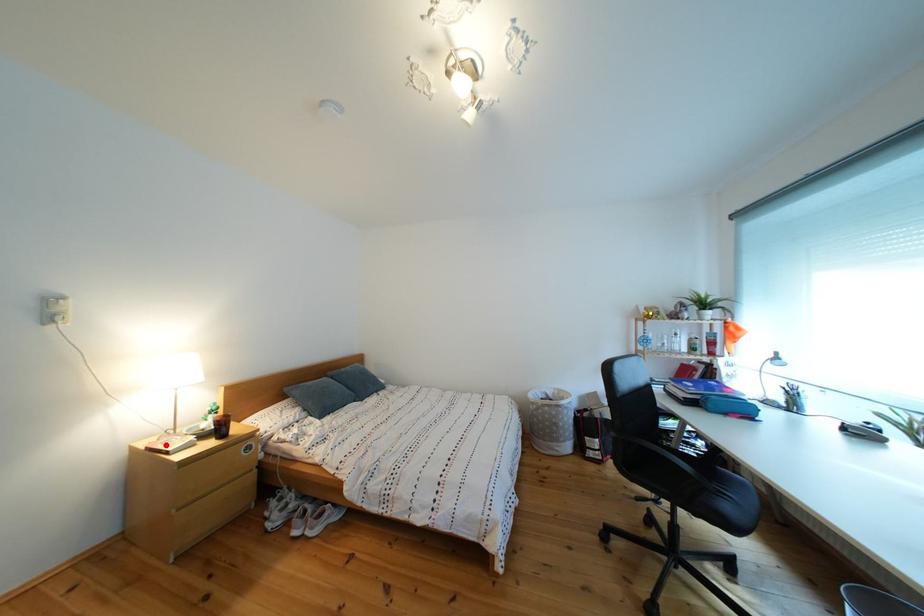
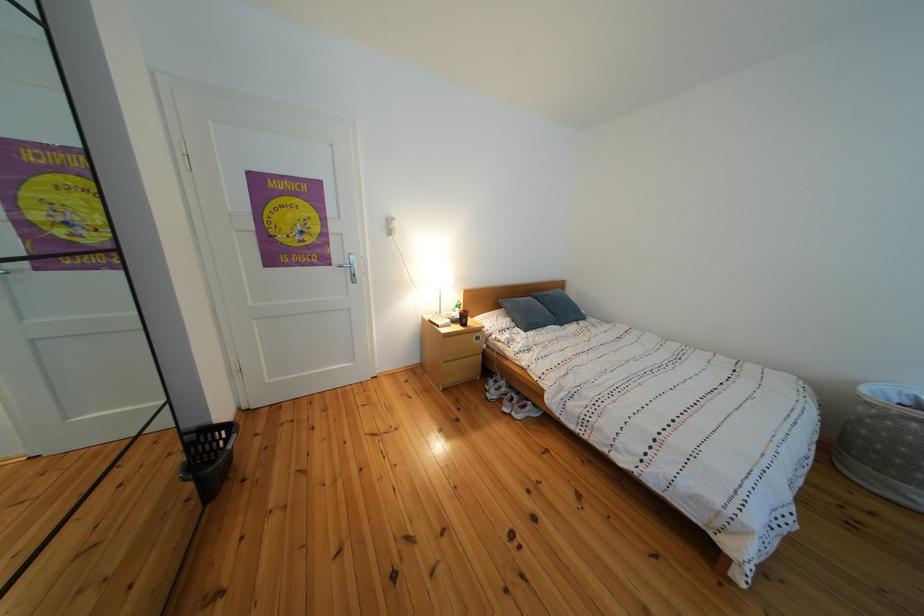
Find the pixel in the second image that matches the highlighted location in the first image.

(443, 322)